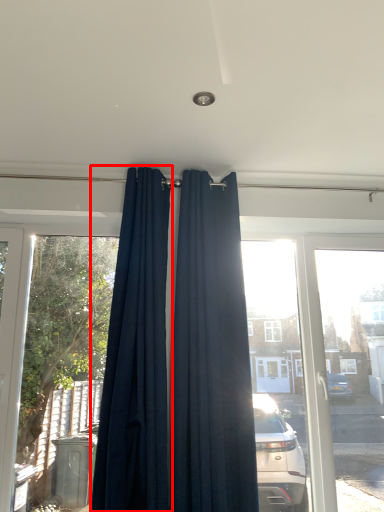
Question: From the image's perspective, what is the correct spatial relationship of curtain (annotated by the red box) in relation to curtain?

Choices:
 (A) below
 (B) above

Answer: (B)